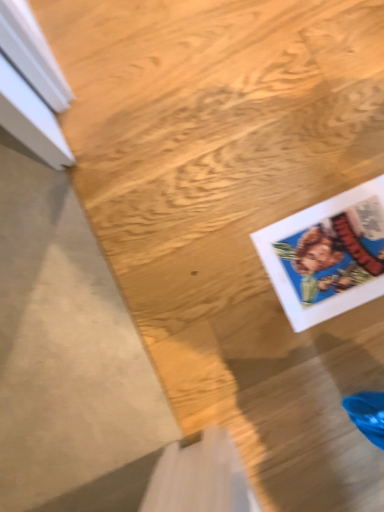
Locate an element on the screen. matte paper comic book at lower right is located at coordinates (327, 255).

In order to face matte paper comic book at lower right, should I rotate leftwards or rightwards?

Turn right approximately 19.819 degrees to face it.

What do you see at coordinates (327, 255) in the screenshot?
I see `matte paper comic book at lower right` at bounding box center [327, 255].

Find the location of a particular element. This screenshot has height=512, width=384. matte paper comic book at lower right is located at coordinates (327, 255).